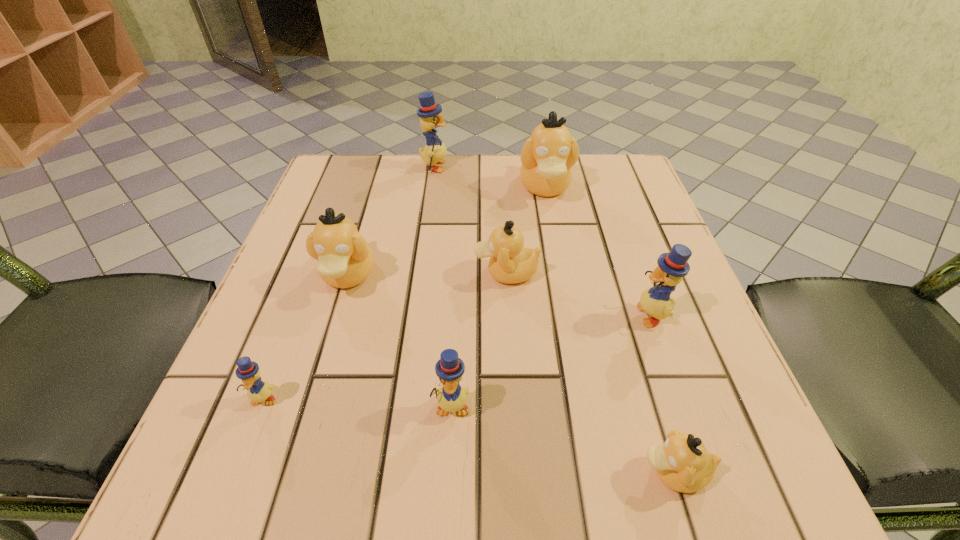
Find the location of a particular element. The width and height of the screenshot is (960, 540). free space located 0.300m on the face of the third biggest tan duckling is located at coordinates (313, 273).

Locate an element on the screen. The height and width of the screenshot is (540, 960). free space located 0.130m on the face of the nearest duckling is located at coordinates (537, 472).

Find the location of a particular element. The image size is (960, 540). vacant space located 0.290m on the face of the nearest duckling is located at coordinates (412, 472).

The width and height of the screenshot is (960, 540). Identify the location of vacant region located 0.370m on the face of the nearest duckling. (349, 472).

You are a GUI agent. You are given a task and a screenshot of the screen. Output one action in this format:
    pyautogui.click(x=<x>, y=<y>)
    Task: Click on the vacant space situated 0.090m on the face of the leftmost yellow duckling, where the monocle is placed
    The image size is (960, 540).
    Given the screenshot: What is the action you would take?
    pyautogui.click(x=234, y=474)

I want to click on object located in the near edge section of the desktop, so click(x=682, y=463).

Identify the location of object that is positioned at the near right corner. (682, 463).

In the image, there is a desktop. Where is `vacant space at the far edge`? vacant space at the far edge is located at coordinates (436, 178).

In the image, there is a desktop. In order to click on vacant space at the near edge in this screenshot , I will do `click(517, 472)`.

What are the coordinates of `vacant area at the left edge of the desktop` in the screenshot? It's located at (323, 365).